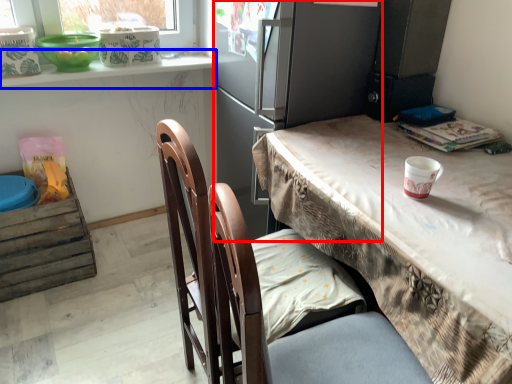
Question: Which object appears closest to the camera in this image, fridge (highlighted by a red box) or window sill (highlighted by a blue box)?

Choices:
 (A) fridge
 (B) window sill

Answer: (A)